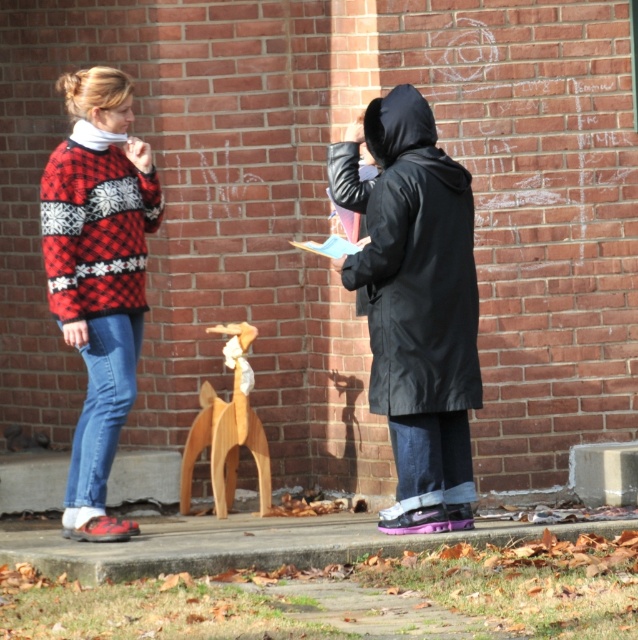
Which of these two, black matte coat at center or red plaid sweater at left, stands shorter?

red plaid sweater at left

Can you confirm if black matte coat at center is shorter than red plaid sweater at left?

Incorrect, black matte coat at center's height does not fall short of red plaid sweater at left's.

Does point (443, 180) come behind point (73, 152)?

No, it is not.

Where is `black matte coat at center`? The image size is (638, 640). black matte coat at center is located at coordinates (417, 266).

Can you confirm if red and white knitted sweater at left is wider than red plaid sweater at left?

No.

Between red and white knitted sweater at left and red plaid sweater at left, which one appears on the left side from the viewer's perspective?

From the viewer's perspective, red and white knitted sweater at left appears more on the left side.

At what (x,y) coordinates should I click in order to perform the action: click on red and white knitted sweater at left. Please return your answer as a coordinate pair (x, y). Looking at the image, I should click on (98, 275).

This screenshot has height=640, width=638. Identify the location of red and white knitted sweater at left. point(98,275).

Is red and white knitted sweater at left wider than wooden horse at center?

Yes, red and white knitted sweater at left is wider than wooden horse at center.

Which is below, red and white knitted sweater at left or wooden horse at center?

wooden horse at center is below.

Between point (98, 403) and point (226, 448), which one is positioned in front?

Point (98, 403)

Where is `red and white knitted sweater at left`? This screenshot has width=638, height=640. red and white knitted sweater at left is located at coordinates (98, 275).